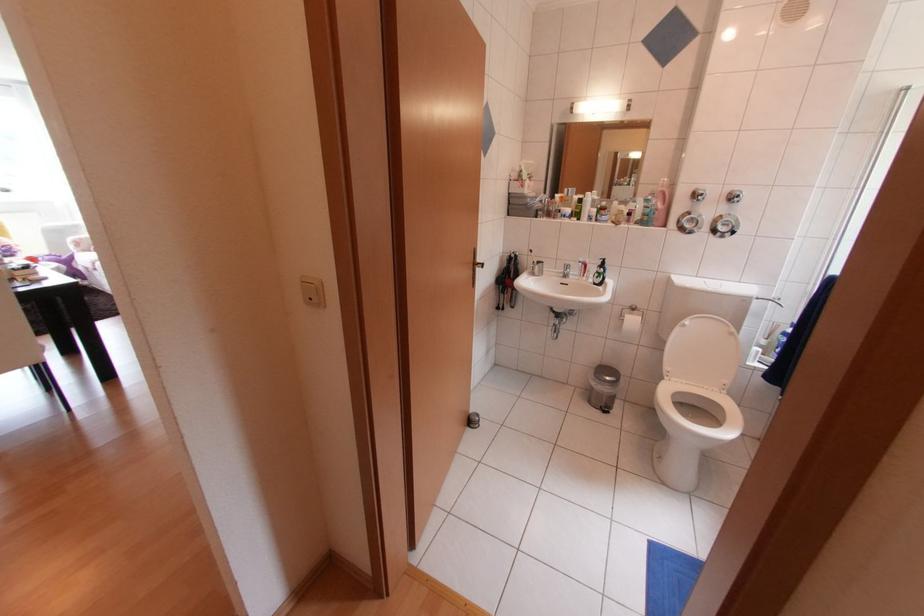
The image size is (924, 616). Describe the element at coordinates (311, 291) in the screenshot. I see `the white light switch` at that location.